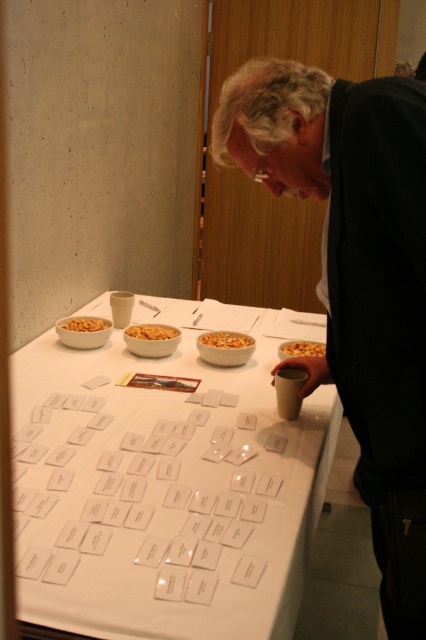
Image resolution: width=426 pixels, height=640 pixels. Describe the element at coordinates (226, 339) in the screenshot. I see `golden crunchy cereal at center` at that location.

The image size is (426, 640). What do you see at coordinates (226, 339) in the screenshot?
I see `golden crunchy cereal at center` at bounding box center [226, 339].

You are a GUI agent. You are given a task and a screenshot of the screen. Output one action in this format:
    pyautogui.click(x=<x>, y=<y>)
    Task: Click on the golden crunchy cereal at center
    This screenshot has height=640, width=426.
    Given the screenshot: What is the action you would take?
    pyautogui.click(x=226, y=339)

Does point (370, 93) come behind point (65, 326)?

No, it is in front of (65, 326).

Which of these two, matte black cup at center or golden crunchy cereal at left, stands taller?

Standing taller between the two is matte black cup at center.

Measure the distance between matte black cup at center and camera.

matte black cup at center is 32.14 inches away from camera.

Image resolution: width=426 pixels, height=640 pixels. I want to click on matte black cup at center, so click(x=356, y=276).

Between yellow crunchy cereal at center and golden crunchy cereal at left, which one appears on the left side from the viewer's perspective?

Positioned to the left is golden crunchy cereal at left.

Is yellow crunchy cereal at center to the right of golden crunchy cereal at left from the viewer's perspective?

Indeed, yellow crunchy cereal at center is positioned on the right side of golden crunchy cereal at left.

Who is more forward, (x=287, y=349) or (x=97, y=330)?

Point (x=287, y=349) is more forward.

Find the location of a particular element. Image resolution: width=426 pixels, height=640 pixels. yellow crunchy cereal at center is located at coordinates (301, 348).